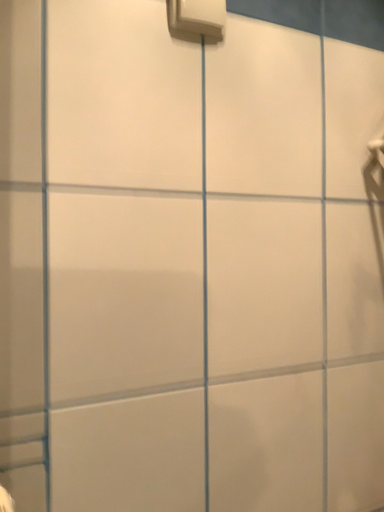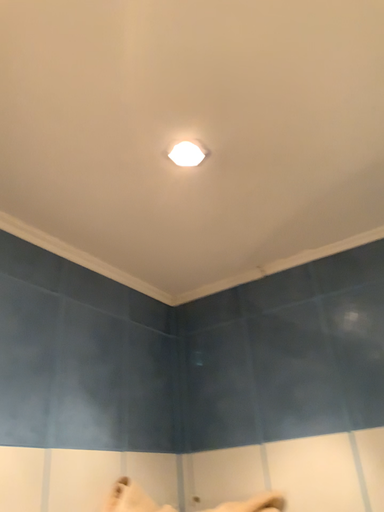
Question: How did the camera likely rotate when shooting the video?

Choices:
 (A) rotated downward
 (B) rotated upward

Answer: (B)